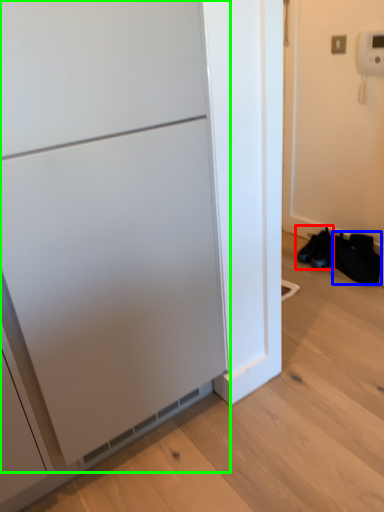
Question: Which is nearer to the footwear (highlighted by a red box)? shoe (highlighted by a blue box) or appliance (highlighted by a green box).

Choices:
 (A) shoe
 (B) appliance

Answer: (A)